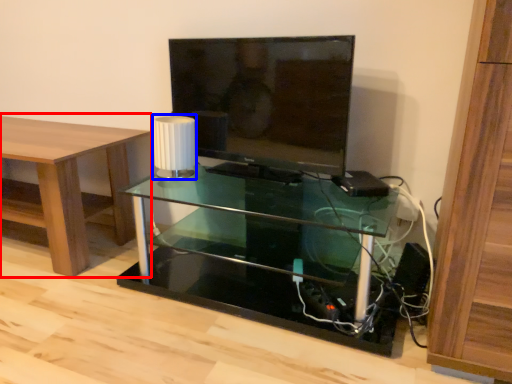
Question: Which object appears farthest to the camera in this image, table (highlighted by a red box) or lamp (highlighted by a blue box)?

Choices:
 (A) table
 (B) lamp

Answer: (B)